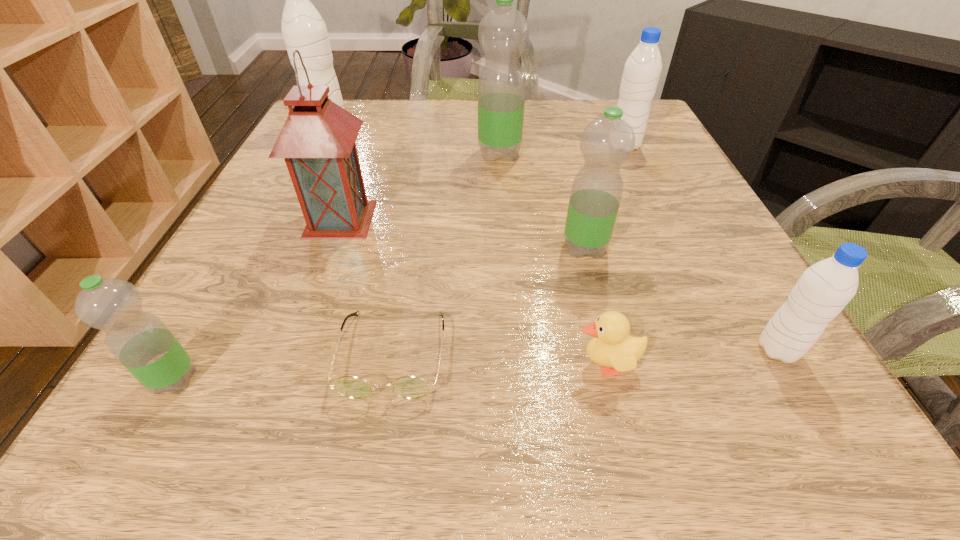
Find the location of a particular element. spectacles that is positioned at the near edge is located at coordinates (408, 387).

You are a GUI agent. You are given a task and a screenshot of the screen. Output one action in this format:
    pyautogui.click(x=<x>, y=<y>)
    Task: Click on the lantern that is positioned at the left edge
    
    Given the screenshot: What is the action you would take?
    pyautogui.click(x=317, y=141)

What are the coordinates of `object present at the far left corner` in the screenshot? It's located at (303, 28).

The height and width of the screenshot is (540, 960). Identify the location of object positioned at the near left corner. (140, 341).

At what (x,y) coordinates should I click in order to perform the action: click on object present at the far right corner. Please return your answer as a coordinate pair (x, y). This screenshot has height=540, width=960. Looking at the image, I should click on (642, 70).

Find the location of a particular element. The width and height of the screenshot is (960, 540). vacant area at the far edge of the desktop is located at coordinates (560, 142).

This screenshot has height=540, width=960. I want to click on vacant space at the near edge of the desktop, so click(469, 404).

You are a GUI agent. You are given a task and a screenshot of the screen. Output one action in this format:
    pyautogui.click(x=<x>, y=<y>)
    Task: Click on the free region at the left edge of the desktop
    This screenshot has width=960, height=540.
    Given the screenshot: What is the action you would take?
    pyautogui.click(x=201, y=334)

The height and width of the screenshot is (540, 960). Identify the location of vacant space at the far left corner. (375, 101).

Find the location of a particular element. This screenshot has height=540, width=960. vacant space at the near left corner of the desktop is located at coordinates (221, 440).